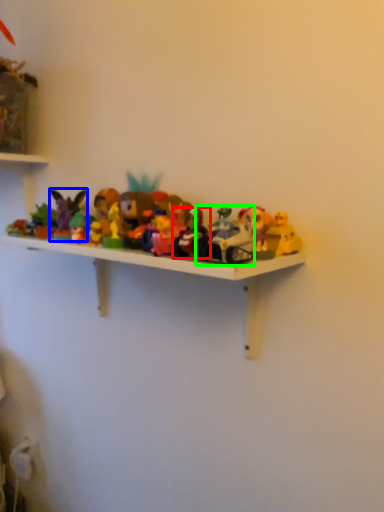
Question: Which object is positioned farthest from toy (highlighted by a red box)? Select from toy (highlighted by a blue box) and toy (highlighted by a green box).

Choices:
 (A) toy
 (B) toy

Answer: (A)